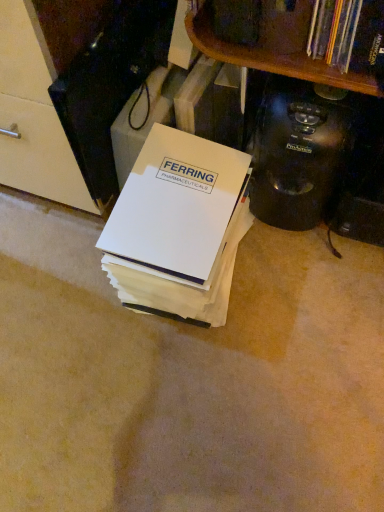
What do you see at coordinates (178, 226) in the screenshot? The image size is (384, 512). I see `white paper at center` at bounding box center [178, 226].

Locate an element on the screen. The width and height of the screenshot is (384, 512). white paper at center is located at coordinates (178, 226).

You are a GUI agent. You are given a task and a screenshot of the screen. Output one action in this format:
    pyautogui.click(x=<x>, y=<y>)
    Task: Click on the black plastic coffee maker at right
    
    Given the screenshot: What is the action you would take?
    pyautogui.click(x=299, y=152)

The width and height of the screenshot is (384, 512). Describe the element at coordinates (299, 152) in the screenshot. I see `black plastic coffee maker at right` at that location.

What is the approximate height of black plastic coffee maker at right?

13.19 inches.

Where is `white paper at center`? The image size is (384, 512). white paper at center is located at coordinates (178, 226).

Based on their positions, is white paper at center located to the left or right of black plastic coffee maker at right?

In the image, white paper at center appears on the left side of black plastic coffee maker at right.

Is white paper at center closer to camera compared to black plastic coffee maker at right?

That is True.

Does point (115, 225) appear closer or farther from the camera than point (325, 100)?

Point (115, 225) is farther from the camera than point (325, 100).

From the image's perspective, does white paper at center appear lower than black plastic coffee maker at right?

Correct, white paper at center appears lower than black plastic coffee maker at right in the image.

From a real-world perspective, is white paper at center above or below black plastic coffee maker at right?

From a real-world perspective, white paper at center is physically below black plastic coffee maker at right.

Looking at this image, which object is wider, white paper at center or black plastic coffee maker at right?

white paper at center is wider.

Who is taller, white paper at center or black plastic coffee maker at right?

With more height is black plastic coffee maker at right.

Considering the sizes of white paper at center and black plastic coffee maker at right in the image, is white paper at center bigger or smaller than black plastic coffee maker at right?

Clearly, white paper at center is larger in size than black plastic coffee maker at right.

Is black plastic coffee maker at right located within white paper at center?

Actually, black plastic coffee maker at right is outside white paper at center.

Consider the image. Are white paper at center and black plastic coffee maker at right far apart?

No, white paper at center is not far away from black plastic coffee maker at right.

Is white paper at center facing away from black plastic coffee maker at right?

That's not correct — white paper at center is not looking away from black plastic coffee maker at right.

Based on the photo, how far apart are white paper at center and black plastic coffee maker at right?

A distance of 8.29 inches exists between white paper at center and black plastic coffee maker at right.

In order to click on appliance located above the white paper at center (from the image's perspective) in this screenshot , I will do `click(299, 152)`.

Which is more to the right, black plastic coffee maker at right or white paper at center?

black plastic coffee maker at right.

Which is behind, black plastic coffee maker at right or white paper at center?

black plastic coffee maker at right is further from the camera.

Does point (343, 100) appear closer or farther from the camera than point (171, 209)?

Point (343, 100).

From the image's perspective, which one is positioned higher, black plastic coffee maker at right or white paper at center?

black plastic coffee maker at right appears higher in the image.

From a real-world perspective, is black plastic coffee maker at right physically below white paper at center?

Incorrect, from a real-world perspective, black plastic coffee maker at right is higher than white paper at center.

Does black plastic coffee maker at right have a greater width compared to white paper at center?

In fact, black plastic coffee maker at right might be narrower than white paper at center.

Can you confirm if black plastic coffee maker at right is taller than white paper at center?

Correct, black plastic coffee maker at right is much taller as white paper at center.

In the scene shown: Between black plastic coffee maker at right and white paper at center, which one has smaller size?

With smaller size is black plastic coffee maker at right.

Is black plastic coffee maker at right surrounding white paper at center?

No, white paper at center is not surrounded by black plastic coffee maker at right.

Are black plastic coffee maker at right and white paper at center making contact?

They are not placed beside each other.

Is black plastic coffee maker at right looking in the opposite direction of white paper at center?

That's not correct — black plastic coffee maker at right is not looking away from white paper at center.

How many degrees apart are the facing directions of black plastic coffee maker at right and white paper at center?

The angular difference between black plastic coffee maker at right and white paper at center is 1.41 degrees.

In the scene shown: Measure the distance between black plastic coffee maker at right and white paper at center.

black plastic coffee maker at right is 8.29 inches from white paper at center.

Where is `box located underneath the black plastic coffee maker at right (from a real-world perspective)`? box located underneath the black plastic coffee maker at right (from a real-world perspective) is located at coordinates (178, 226).

Image resolution: width=384 pixels, height=512 pixels. In order to click on box located underneath the black plastic coffee maker at right (from a real-world perspective) in this screenshot , I will do `click(178, 226)`.

Find the location of `appliance above the white paper at center (from the image's perspective)`. appliance above the white paper at center (from the image's perspective) is located at coordinates (299, 152).